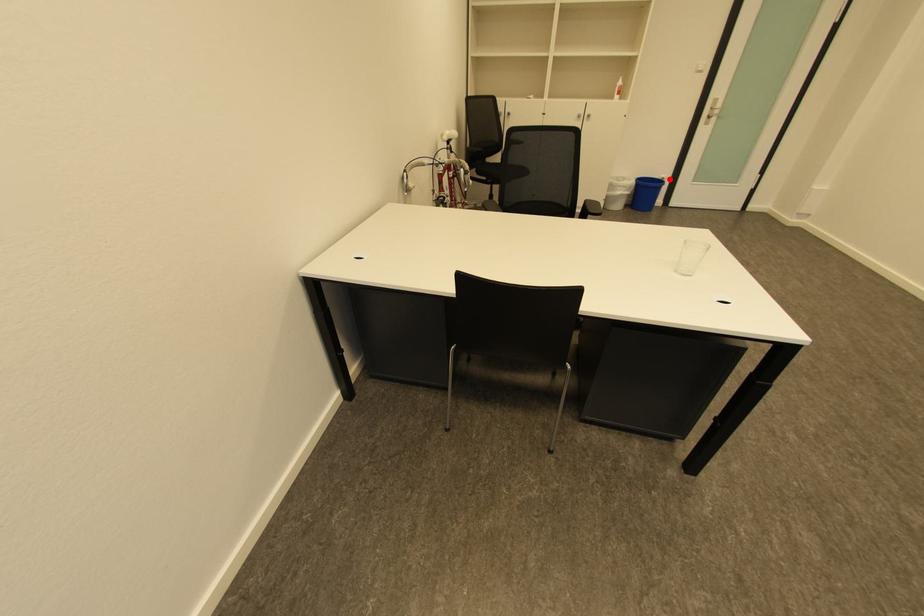
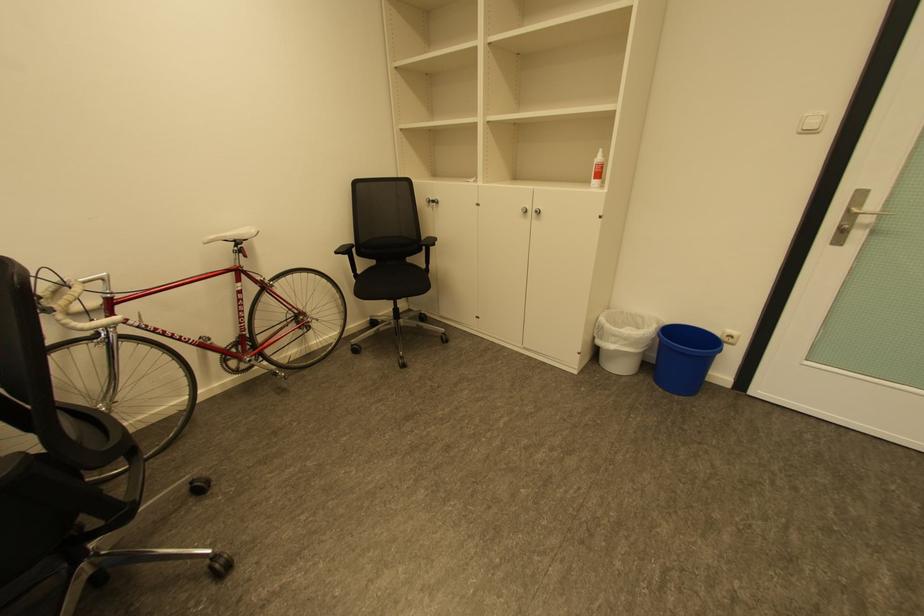
Question: I am providing you with two images of the same scene from different viewpoints. Image1 has a red point marked. In image2, the corresponding 3D location appears at what relative position? Reply with the corresponding letter.

Choices:
 (A) Closer
 (B) Farther

Answer: (B)